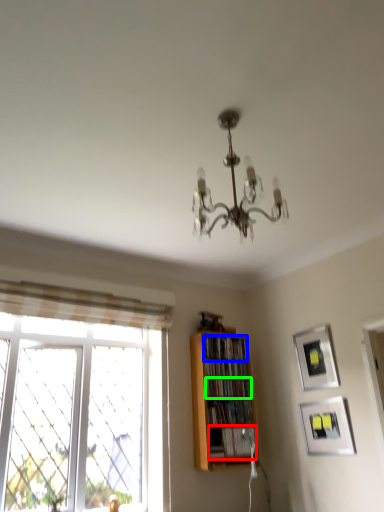
Question: Which is nearer to the book (highlighted by a red box)? book (highlighted by a blue box) or book (highlighted by a green box).

Choices:
 (A) book
 (B) book

Answer: (B)